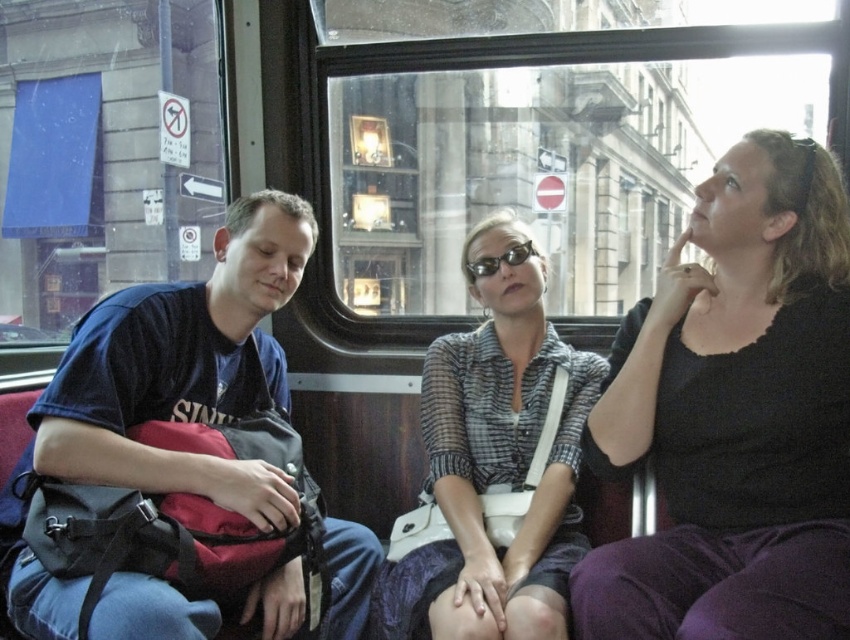
You are a passenger on a bus and you see two people wearing shirts. The first is wearing a black matte shirt at upper right and the second is wearing a plaid shirt at center. Which shirt is positioned higher in the image?

The black matte shirt at upper right is positioned higher in the image than the plaid shirt at center.

You are a photographer trying to capture a candid shot of the two central figures in the scene. You want to ensure that both the plaid shirt at center and the black plastic sunglasses at center are clearly visible in the frame. Based on their relative sizes, which object should you focus on to ensure both are in focus without adjusting your camera settings?

The plaid shirt at center is wider than the black plastic sunglasses at center, so focusing on the plaid shirt at center would ensure both objects are in focus since it is larger and occupies more space in the frame.